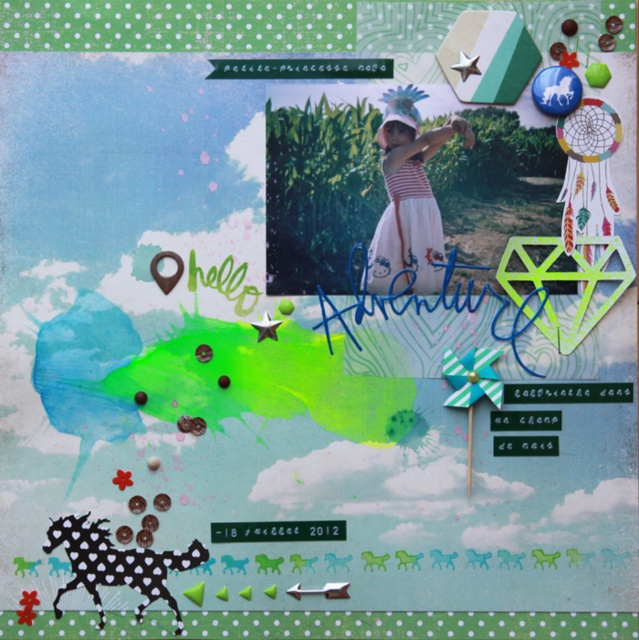
Question: Is striped cotton dress at center further to camera compared to black dotted horse at lower left?

Choices:
 (A) yes
 (B) no

Answer: (A)

Question: Does striped cotton dress at center appear on the left side of black dotted horse at lower left?

Choices:
 (A) no
 (B) yes

Answer: (A)

Question: Can you confirm if striped cotton dress at center is smaller than black dotted horse at lower left?

Choices:
 (A) no
 (B) yes

Answer: (A)

Question: Among these objects, which one is nearest to the camera?

Choices:
 (A) black dotted horse at lower left
 (B) striped cotton dress at center

Answer: (A)